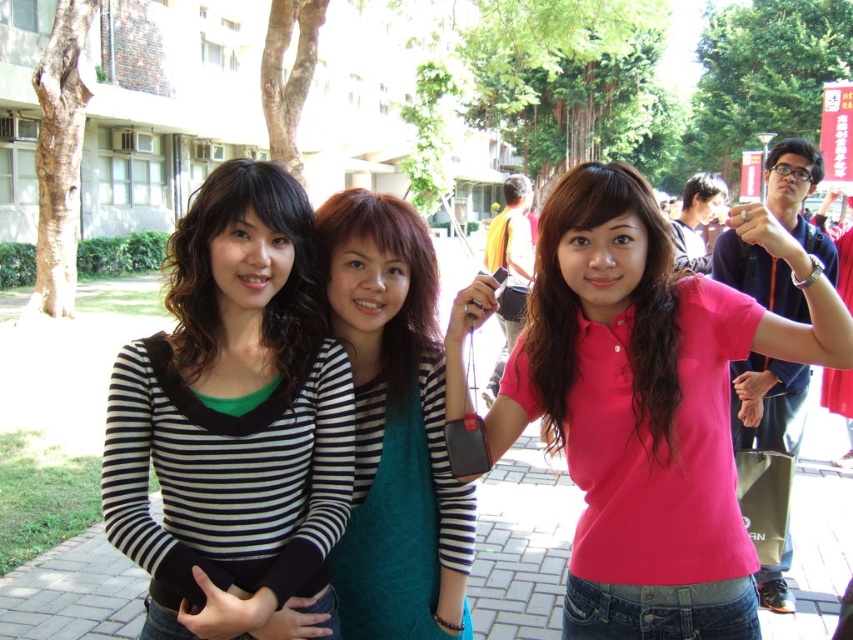
Question: Estimate the real-world distances between objects in this image. Which object is closer to the pink matte shirt at center?

Choices:
 (A) striped fabric shirt at center
 (B) pink matte shirt at upper right
 (C) black and white striped shirt at center

Answer: (A)

Question: Which object is farther from the camera taking this photo?

Choices:
 (A) pink matte shirt at upper right
 (B) black and white striped shirt at center
 (C) pink matte shirt at center

Answer: (A)

Question: Among these points, which one is farthest from the camera?

Choices:
 (A) tap(776, 573)
 (B) tap(215, 557)
 (C) tap(434, 369)
 (D) tap(699, 593)

Answer: (A)

Question: Considering the relative positions of pink matte shirt at center and striped fabric shirt at center in the image provided, where is pink matte shirt at center located with respect to striped fabric shirt at center?

Choices:
 (A) above
 (B) below

Answer: (B)

Question: Does striped fabric shirt at center appear on the right side of pink matte shirt at upper right?

Choices:
 (A) no
 (B) yes

Answer: (A)

Question: Does pink matte shirt at center appear under pink matte shirt at upper right?

Choices:
 (A) yes
 (B) no

Answer: (A)